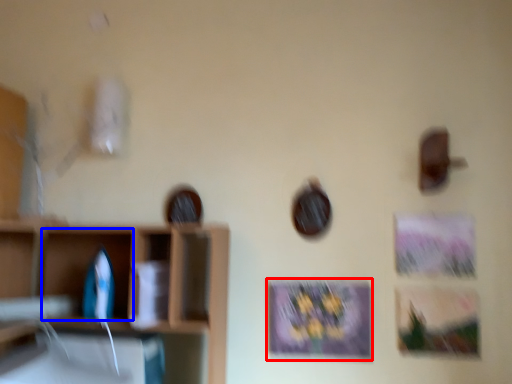
Question: Which point is closer to the camera, picture frame (highlighted by a red box) or cabinet (highlighted by a blue box)?

Choices:
 (A) picture frame
 (B) cabinet

Answer: (B)